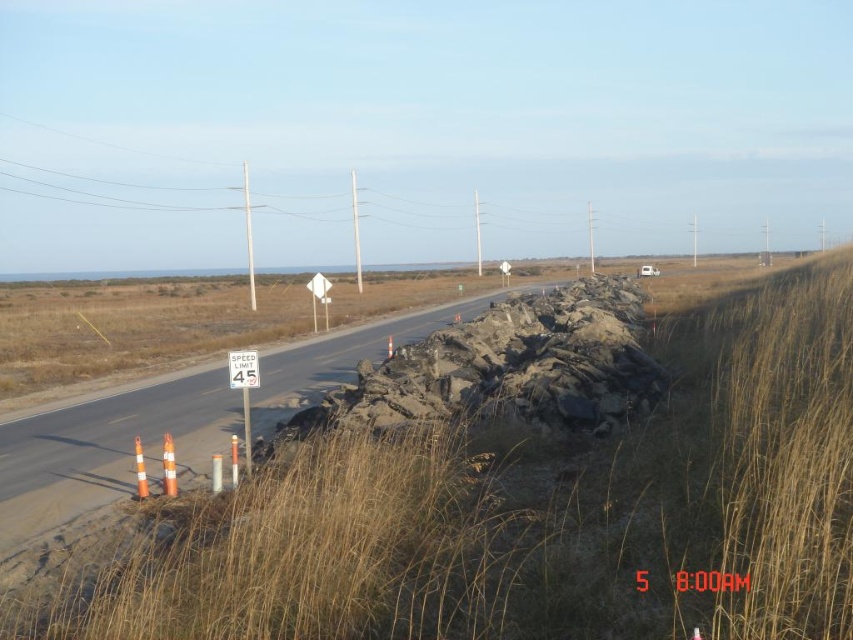
Question: Does brown dry grass at center have a greater width compared to metal speed limit sign at center?

Choices:
 (A) yes
 (B) no

Answer: (A)

Question: Among these points, which one is farthest from the camera?

Choices:
 (A) [239, 365]
 (B) [358, 580]
 (C) [254, 378]

Answer: (C)

Question: Can you confirm if brown dry grass at center is positioned to the left of white plastic speed limit sign at center?

Choices:
 (A) no
 (B) yes

Answer: (A)

Question: Which point is farther to the camera?

Choices:
 (A) (252, 387)
 (B) (242, 364)
 (C) (341, 529)

Answer: (A)

Question: Which object appears farthest from the camera in this image?

Choices:
 (A) white plastic speed limit sign at center
 (B) metal speed limit sign at center
 (C) brown dry grass at center

Answer: (B)

Question: Does white plastic speed limit sign at center appear over metal speed limit sign at center?

Choices:
 (A) no
 (B) yes

Answer: (A)